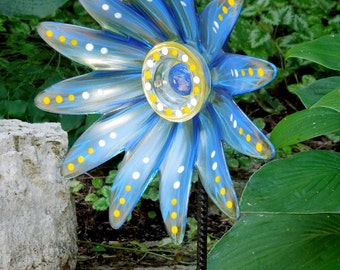
Identify the location of sculpture. (185, 49).